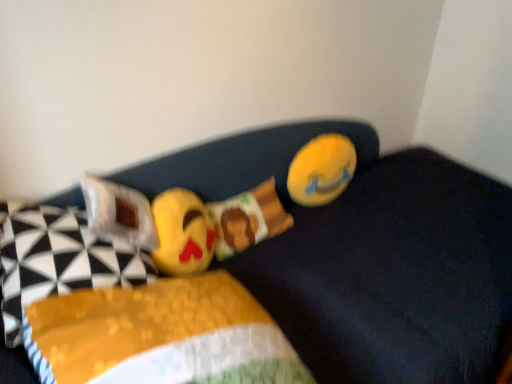
Question: Do you think white fabric pillow at left, which is counted as the 2th pillow, starting from the left, is within yellow plush toy at upper right, the first toy viewed from the right, or outside of it?

Choices:
 (A) inside
 (B) outside

Answer: (B)

Question: Is white fabric pillow at left, marked as the 1th pillow in a right-to-left arrangement, taller or shorter than yellow plush toy at upper right, the first toy viewed from the right?

Choices:
 (A) tall
 (B) short

Answer: (B)

Question: Which of these objects is positioned closest to the yellow fabric pillow at left, marked as the 1th pillow in a left-to-right arrangement?

Choices:
 (A) soft plush emoji at center, which is the 2th toy in right-to-left order
 (B) white fabric pillow at left, marked as the 1th pillow in a right-to-left arrangement
 (C) yellow plush toy at upper right, the first toy viewed from the right
 (D) yellow fabric pillow at center

Answer: (B)

Question: Which object is the farthest from the yellow fabric pillow at center?

Choices:
 (A) yellow fabric pillow at left, marked as the 1th pillow in a left-to-right arrangement
 (B) soft plush emoji at center, which ranks as the 1th toy in left-to-right order
 (C) white fabric pillow at left, which is counted as the 2th pillow, starting from the left
 (D) yellow plush toy at upper right, acting as the 2th toy starting from the front

Answer: (C)